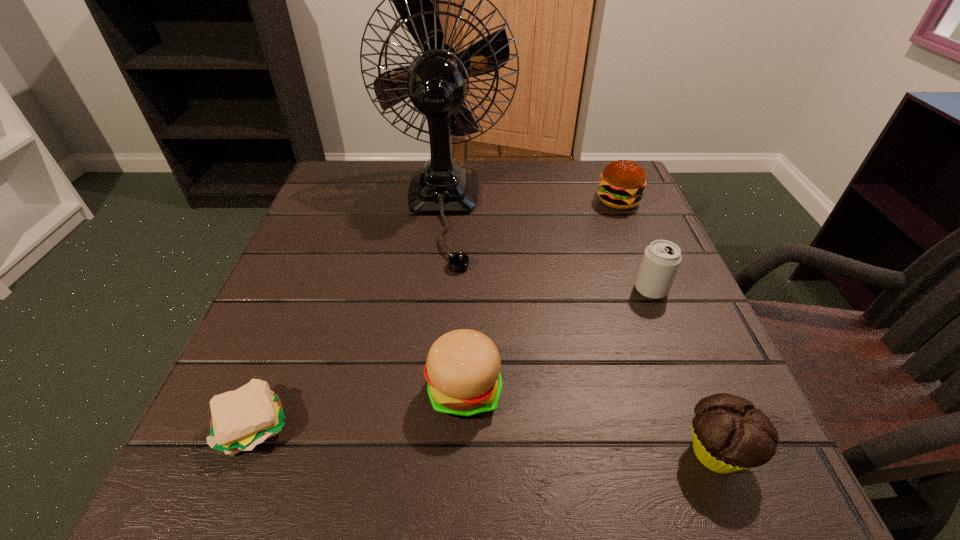
At what (x,y) coordinates should I click in order to perform the action: click on vacant region located 0.220m on the left of the nearer hamburger. Please return your answer as a coordinate pair (x, y). Looking at the image, I should click on (283, 390).

Image resolution: width=960 pixels, height=540 pixels. Find the location of `free space located 0.060m on the back of the muffin`. free space located 0.060m on the back of the muffin is located at coordinates (689, 384).

This screenshot has height=540, width=960. Find the location of `vacant area located on the back of the patty`. vacant area located on the back of the patty is located at coordinates (305, 302).

The image size is (960, 540). What are the coordinates of `fan that is at the far edge` in the screenshot? It's located at (437, 81).

You are a GUI agent. You are given a task and a screenshot of the screen. Output one action in this format:
    pyautogui.click(x=<x>, y=<y>)
    Task: Click on the hamburger that is at the far edge
    This screenshot has height=540, width=960.
    Given the screenshot: What is the action you would take?
    coord(622,182)

Where is `muffin present at the near edge`? The image size is (960, 540). muffin present at the near edge is located at coordinates (729, 434).

The image size is (960, 540). I want to click on patty that is at the near edge, so click(241, 419).

Find the location of a particular element. The height and width of the screenshot is (540, 960). fan situated at the left edge is located at coordinates (437, 81).

Find the location of a particular element. patty at the left edge is located at coordinates (241, 419).

The width and height of the screenshot is (960, 540). Find the location of `can positioned at the right edge`. can positioned at the right edge is located at coordinates (661, 260).